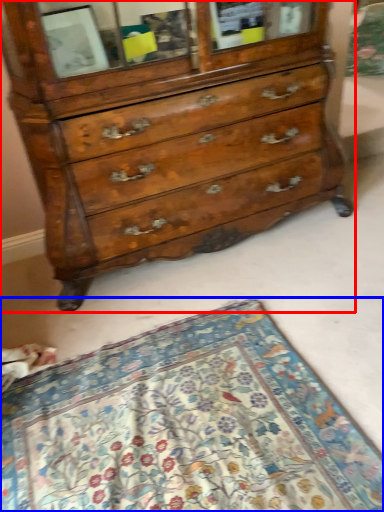
Question: Among these objects, which one is farthest to the camera, chest of drawers (highlighted by a red box) or mat (highlighted by a blue box)?

Choices:
 (A) chest of drawers
 (B) mat

Answer: (A)